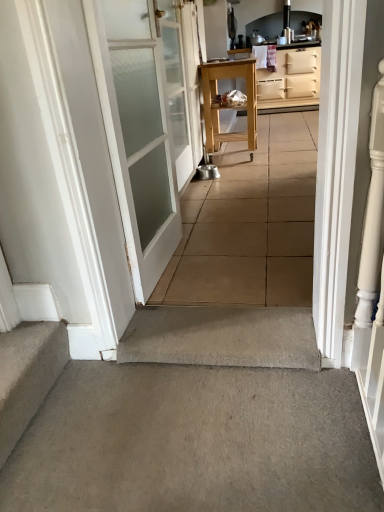
This screenshot has height=512, width=384. I want to click on carpeted stairs at lower left, so click(x=27, y=375).

Image resolution: width=384 pixels, height=512 pixels. What do you see at coordinates (27, 375) in the screenshot? I see `carpeted stairs at lower left` at bounding box center [27, 375].

The width and height of the screenshot is (384, 512). What do you see at coordinates (181, 82) in the screenshot? I see `white frosted glass door at upper left, which is the second door in front-to-back order` at bounding box center [181, 82].

What are the coordinates of `gray concrete at center` in the screenshot? It's located at (195, 442).

Which is nearer, (30,365) or (180,97)?

Point (30,365) appears to be closer to the viewer than point (180,97).

From the image's perspective, is carpeted stairs at lower left located above or below white frosted glass door at upper left, which is the second door in front-to-back order?

carpeted stairs at lower left is situated lower than white frosted glass door at upper left, which is the second door in front-to-back order, in the image.

Based on the photo, considering the relative positions of carpeted stairs at lower left and white frosted glass door at upper left, positioned as the 1th door in back-to-front order, in the image provided, is carpeted stairs at lower left to the right of white frosted glass door at upper left, positioned as the 1th door in back-to-front order, from the viewer's perspective?

No.

Could you tell me if white frosted glass door at upper left, positioned as the 1th door in back-to-front order, is turned towards beige matte cabinet at upper right?

No, white frosted glass door at upper left, positioned as the 1th door in back-to-front order, is not aimed at beige matte cabinet at upper right.

Is white frosted glass door at upper left, positioned as the 1th door in back-to-front order, far from beige matte cabinet at upper right?

white frosted glass door at upper left, positioned as the 1th door in back-to-front order, is far away from beige matte cabinet at upper right.

Identify the location of the 1st door to the left when counting from the beige matte cabinet at upper right. The height and width of the screenshot is (512, 384). (181, 82).

Based on the photo, is beige matte cabinet at upper right wider than gray concrete at center?

In fact, beige matte cabinet at upper right might be narrower than gray concrete at center.

Is beige matte cabinet at upper right inside or outside of gray concrete at center?

beige matte cabinet at upper right cannot be found inside gray concrete at center.

Is the position of beige matte cabinet at upper right more distant than that of gray concrete at center?

Yes, it is.

How different are the orientations of gray concrete at center and white frosted glass door at upper left, positioned as the 1th door in back-to-front order, in degrees?

1.59 degrees.

From the picture: Is white frosted glass door at upper left, which is the second door in front-to-back order, at the back of gray concrete at center?

No, white frosted glass door at upper left, which is the second door in front-to-back order, is not at the back of gray concrete at center.

From the image's perspective, which one is positioned lower, gray concrete at center or white frosted glass door at upper left, which is the second door in front-to-back order?

gray concrete at center, from the image's perspective.

This screenshot has height=512, width=384. I want to click on door that is the 2nd object located behind the gray concrete at center, so click(x=181, y=82).

Considering the sizes of objects beige matte cabinet at upper right and carpeted stairs at lower left in the image provided, who is wider, beige matte cabinet at upper right or carpeted stairs at lower left?

beige matte cabinet at upper right is wider.

Is beige matte cabinet at upper right bigger or smaller than carpeted stairs at lower left?

Clearly, beige matte cabinet at upper right is larger in size than carpeted stairs at lower left.

Based on the photo, is beige matte cabinet at upper right not near carpeted stairs at lower left?

Yes, beige matte cabinet at upper right and carpeted stairs at lower left are quite far apart.

At what (x,y) coordinates should I click in order to perform the action: click on stairs beneath the beige matte cabinet at upper right (from a real-world perspective). Please return your answer as a coordinate pair (x, y). The height and width of the screenshot is (512, 384). Looking at the image, I should click on (27, 375).

Is carpeted stairs at lower left completely or partially outside of natural wood table at center?

That's correct, carpeted stairs at lower left is outside of natural wood table at center.

Considering the relative sizes of carpeted stairs at lower left and natural wood table at center in the image provided, is carpeted stairs at lower left smaller than natural wood table at center?

Correct, carpeted stairs at lower left occupies less space than natural wood table at center.

From the image's perspective, is carpeted stairs at lower left located above natural wood table at center?

No, from the image's perspective, carpeted stairs at lower left is not above natural wood table at center.

Considering the sizes of carpeted stairs at lower left and natural wood table at center in the image, is carpeted stairs at lower left wider or thinner than natural wood table at center?

carpeted stairs at lower left is thinner than natural wood table at center.

From a real-world perspective, which is physically above, gray concrete at center or white frosted glass door at left, acting as the first door starting from the front?

From a 3D spatial view, white frosted glass door at left, acting as the first door starting from the front, is above.

In the scene shown: Could you measure the distance between gray concrete at center and white frosted glass door at left, marked as the second door in a back-to-front arrangement?

gray concrete at center is 32.82 inches away from white frosted glass door at left, marked as the second door in a back-to-front arrangement.

In terms of height, does gray concrete at center look taller or shorter compared to white frosted glass door at left, marked as the second door in a back-to-front arrangement?

Considering their sizes, gray concrete at center has less height than white frosted glass door at left, marked as the second door in a back-to-front arrangement.

Considering the positions of points (292, 500) and (133, 177), is point (292, 500) closer to camera compared to point (133, 177)?

Yes, it is in front of point (133, 177).

The height and width of the screenshot is (512, 384). Identify the location of stairs in front of the white frosted glass door at upper left, positioned as the 1th door in back-to-front order. (27, 375).

Image resolution: width=384 pixels, height=512 pixels. I want to click on cabinetry behind the white frosted glass door at upper left, positioned as the 1th door in back-to-front order, so click(290, 79).

Looking at the image, which one is located closer to white frosted glass door at left, acting as the first door starting from the front, carpeted stairs at lower left or white frosted glass door at upper left, positioned as the 1th door in back-to-front order?

white frosted glass door at upper left, positioned as the 1th door in back-to-front order, lies closer to white frosted glass door at left, acting as the first door starting from the front, than the other object.

Based on their spatial positions, is white frosted glass door at left, acting as the first door starting from the front, or natural wood table at center closer to white frosted glass door at upper left, which is the second door in front-to-back order?

white frosted glass door at left, acting as the first door starting from the front, is positioned closer to the anchor white frosted glass door at upper left, which is the second door in front-to-back order.

Based on their spatial positions, is gray concrete at center or white frosted glass door at left, marked as the second door in a back-to-front arrangement, further from natural wood table at center?

Based on the image, gray concrete at center appears to be further to natural wood table at center.

When comparing their distances from natural wood table at center, does gray concrete at center or beige matte cabinet at upper right seem closer?

Among the two, beige matte cabinet at upper right is located nearer to natural wood table at center.

Looking at the image, which one is located further to beige matte cabinet at upper right, white frosted glass door at left, acting as the first door starting from the front, or white frosted glass door at upper left, which is the second door in front-to-back order?

The object further to beige matte cabinet at upper right is white frosted glass door at left, acting as the first door starting from the front.

Based on their spatial positions, is white frosted glass door at upper left, which is the second door in front-to-back order, or beige matte cabinet at upper right closer to white frosted glass door at left, acting as the first door starting from the front?

The object closer to white frosted glass door at left, acting as the first door starting from the front, is white frosted glass door at upper left, which is the second door in front-to-back order.

Consider the image. When comparing their distances from white frosted glass door at upper left, which is the second door in front-to-back order, does natural wood table at center or gray concrete at center seem further?

The object further to white frosted glass door at upper left, which is the second door in front-to-back order, is gray concrete at center.

Based on the photo, from the image, which object appears to be farther from carpeted stairs at lower left, white frosted glass door at left, acting as the first door starting from the front, or gray concrete at center?

white frosted glass door at left, acting as the first door starting from the front, lies further to carpeted stairs at lower left than the other object.

You are a GUI agent. You are given a task and a screenshot of the screen. Output one action in this format:
    pyautogui.click(x=<x>, y=<y>)
    Task: Click on the door between white frosted glass door at upper left, positioned as the 1th door in back-to-front order, and gray concrete at center in the up-down direction
    
    Given the screenshot: What is the action you would take?
    pyautogui.click(x=138, y=135)

I want to click on table located between gray concrete at center and beige matte cabinet at upper right in the depth direction, so pos(229,104).

What are the coordinates of `table between white frosted glass door at upper left, which is the second door in front-to-back order, and beige matte cabinet at upper right from front to back` in the screenshot? It's located at (229, 104).

In order to click on table positioned between white frosted glass door at left, acting as the first door starting from the front, and beige matte cabinet at upper right from near to far in this screenshot , I will do `click(229, 104)`.